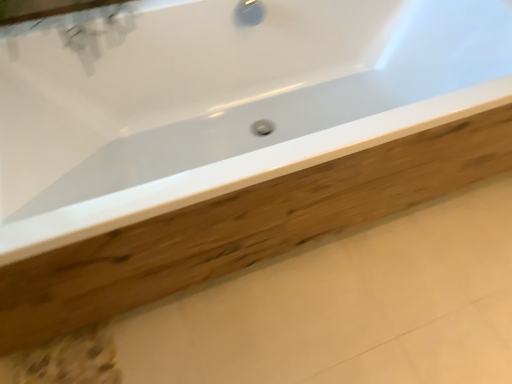
What is the approximate width of white glossy bathtub at center?

It is 35.29 inches.

The width and height of the screenshot is (512, 384). What do you see at coordinates (229, 104) in the screenshot? I see `white glossy bathtub at center` at bounding box center [229, 104].

Image resolution: width=512 pixels, height=384 pixels. I want to click on white glossy bathtub at center, so click(229, 104).

Image resolution: width=512 pixels, height=384 pixels. Describe the element at coordinates (242, 228) in the screenshot. I see `wooden plank at center` at that location.

Identify the location of wooden plank at center. The width and height of the screenshot is (512, 384). (242, 228).

Find the location of a particular element. white glossy bathtub at center is located at coordinates (229, 104).

Which is more to the right, wooden plank at center or white glossy bathtub at center?

wooden plank at center.

Between wooden plank at center and white glossy bathtub at center, which one is positioned in front?

white glossy bathtub at center.

Between point (383, 198) and point (354, 105), which one is positioned behind?

The point (354, 105) is more distant.

From the image's perspective, who appears lower, wooden plank at center or white glossy bathtub at center?

From the image's view, wooden plank at center is below.

From a real-world perspective, is wooden plank at center over white glossy bathtub at center?

No, from a real-world perspective, wooden plank at center is not above white glossy bathtub at center.

Which object is wider, wooden plank at center or white glossy bathtub at center?

wooden plank at center is wider.

Between wooden plank at center and white glossy bathtub at center, which one has less height?

With less height is wooden plank at center.

Who is smaller, wooden plank at center or white glossy bathtub at center?

wooden plank at center is smaller.

Consider the image. Is wooden plank at center outside of white glossy bathtub at center?

Yes, wooden plank at center is outside of white glossy bathtub at center.

Is wooden plank at center positioned far away from white glossy bathtub at center?

No, wooden plank at center is in close proximity to white glossy bathtub at center.

Is wooden plank at center oriented away from white glossy bathtub at center?

No.

Can you tell me how much wooden plank at center and white glossy bathtub at center differ in facing direction?

They differ by 90.2 degrees in their facing directions.

How far apart are wooden plank at center and white glossy bathtub at center?

They are 14.96 inches apart.

At what (x,y) coordinates should I click in order to perform the action: click on bathtub above the wooden plank at center (from the image's perspective). Please return your answer as a coordinate pair (x, y). Image resolution: width=512 pixels, height=384 pixels. Looking at the image, I should click on (229, 104).

Is white glossy bathtub at center at the left side of wooden plank at center?

Indeed, white glossy bathtub at center is positioned on the left side of wooden plank at center.

Does white glossy bathtub at center come in front of wooden plank at center?

Yes, white glossy bathtub at center is closer to the camera.

Is point (405, 19) in front of point (399, 204)?

No, it is behind (399, 204).

From the image's perspective, is white glossy bathtub at center beneath wooden plank at center?

Incorrect, from the image's perspective, white glossy bathtub at center is higher than wooden plank at center.

From a real-world perspective, is white glossy bathtub at center located beneath wooden plank at center?

No, from a real-world perspective, white glossy bathtub at center is not beneath wooden plank at center.

Which of these two, white glossy bathtub at center or wooden plank at center, is wider?

wooden plank at center is wider.

In terms of height, does white glossy bathtub at center look taller or shorter compared to wooden plank at center?

Clearly, white glossy bathtub at center is taller compared to wooden plank at center.

Is white glossy bathtub at center bigger than wooden plank at center?

Yes, white glossy bathtub at center is bigger than wooden plank at center.

Would you say white glossy bathtub at center is outside wooden plank at center?

Yes, white glossy bathtub at center is outside of wooden plank at center.

Is white glossy bathtub at center beside wooden plank at center?

No, white glossy bathtub at center is not next to wooden plank at center.

From the picture: Is white glossy bathtub at center oriented towards wooden plank at center?

No, white glossy bathtub at center does not turn towards wooden plank at center.

How different are the orientations of white glossy bathtub at center and wooden plank at center in degrees?

90.2 degrees separate the facing orientations of white glossy bathtub at center and wooden plank at center.

Where is `plank below the white glossy bathtub at center (from a real-world perspective)`? The image size is (512, 384). plank below the white glossy bathtub at center (from a real-world perspective) is located at coordinates (242, 228).

Find the location of a particular element. The height and width of the screenshot is (384, 512). bathtub in front of the wooden plank at center is located at coordinates (229, 104).

Where is `plank lying below the white glossy bathtub at center (from the image's perspective)`? plank lying below the white glossy bathtub at center (from the image's perspective) is located at coordinates (242, 228).